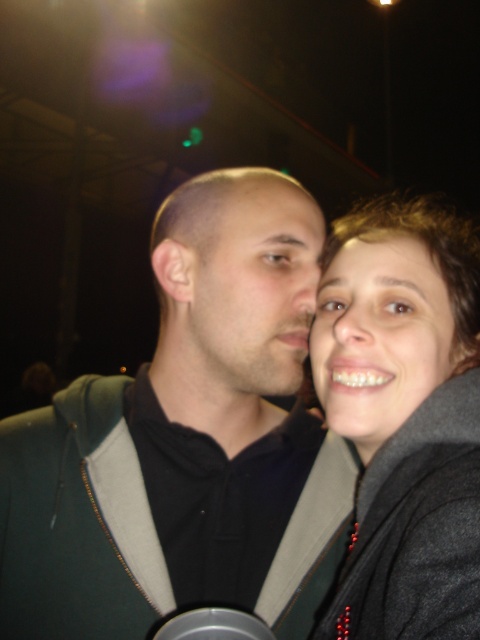
You are a photographer adjusting the focus of your camera. The camera has a focus point at coordinates point (253, 285). Based on the scene, what is the subject of focus?

The point (253, 285) corresponds to the matte black face at center, so the subject of focus is the matte black face at center.

You are a photographer adjusting the focus of your camera. You need to ensure that the dark green hoodie at center is in sharp focus. According to the coordinates provided, where should you adjust the focus point to?

The dark green hoodie at center should be focused at the coordinates point (180, 451) to ensure sharpness.